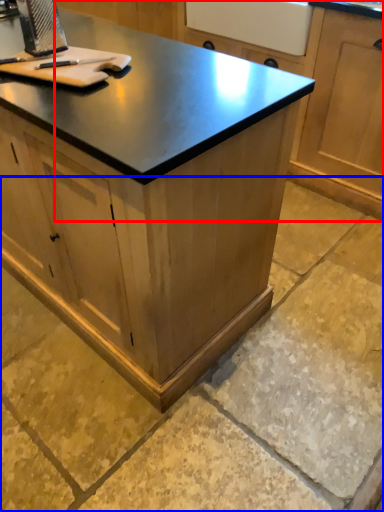
Question: Among these objects, which one is farthest to the camera, cabinetry (highlighted by a red box) or concrete (highlighted by a blue box)?

Choices:
 (A) cabinetry
 (B) concrete

Answer: (A)